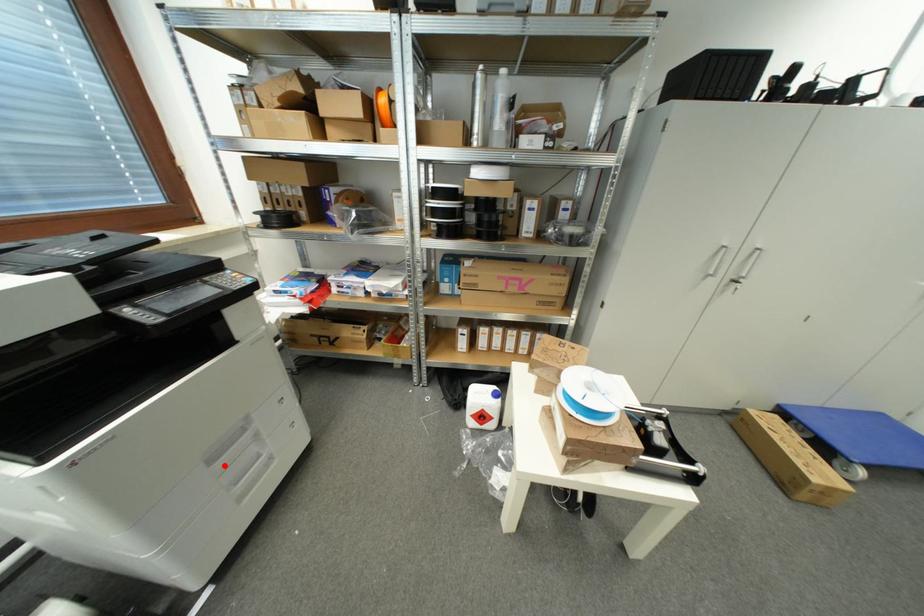
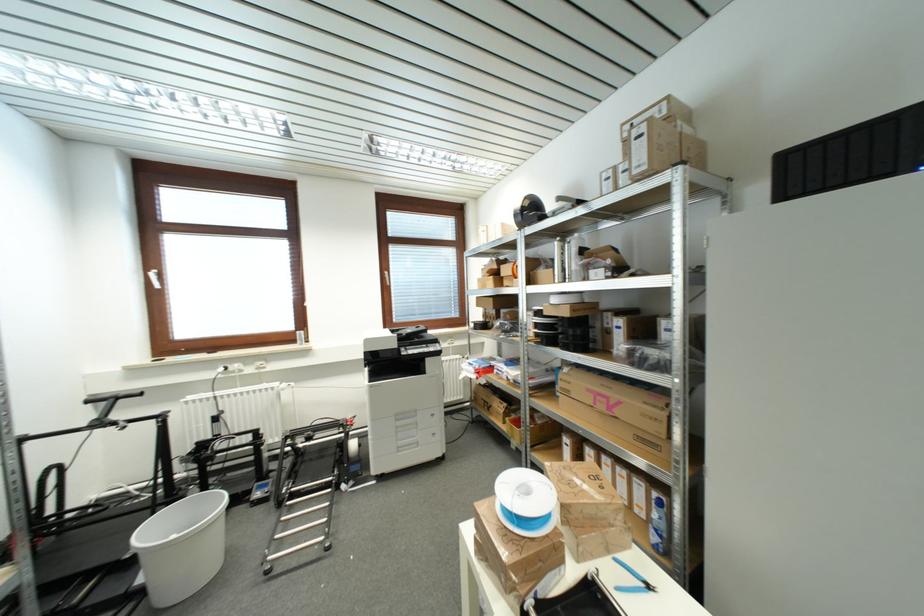
Find the pixel in the second image that matches the highlighted location in the first image.

(404, 426)